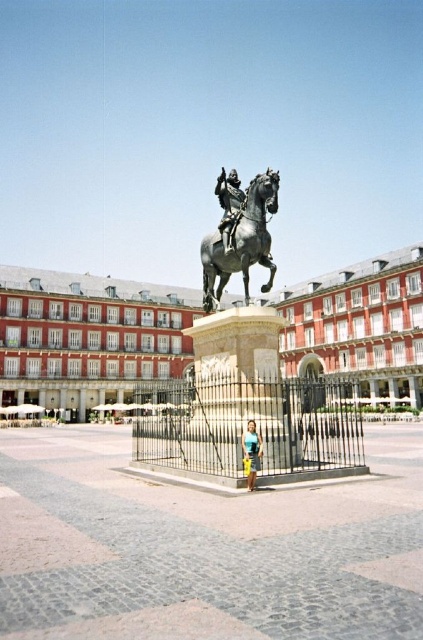
Question: Which of the following is the farthest from the observer?

Choices:
 (A) bronze/golden horse at center
 (B) blue denim shorts at center

Answer: (A)

Question: Among these points, which one is nearest to the camera?

Choices:
 (A) (406, 362)
 (B) (255, 445)

Answer: (B)

Question: Where is red brick building at center located in relation to polished bronze statue at center in the image?

Choices:
 (A) right
 (B) left

Answer: (B)

Question: In this image, where is red brick building at center located relative to polished bronze statue at center?

Choices:
 (A) right
 (B) left

Answer: (B)

Question: Does red brick building at center appear over blue denim shorts at center?

Choices:
 (A) no
 (B) yes

Answer: (B)

Question: Which object is positioned closest to the bronze/golden horse at center?

Choices:
 (A) red brick building at center
 (B) polished bronze statue at center

Answer: (B)